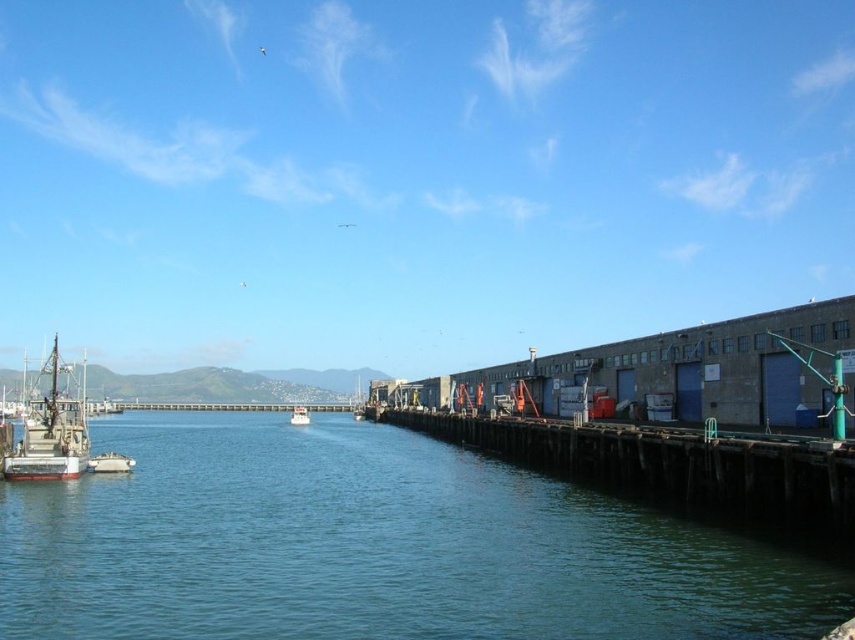
Question: Among these points, which one is nearest to the camera?

Choices:
 (A) (292, 412)
 (B) (46, 472)
 (C) (467, 435)

Answer: (B)

Question: Can you confirm if wooden dock at lower right is positioned to the left of white matte boat at left?

Choices:
 (A) yes
 (B) no

Answer: (B)

Question: Is greenish-blue water at left closer to the viewer compared to white matte boat at left?

Choices:
 (A) no
 (B) yes

Answer: (B)

Question: Among these points, which one is nearest to the camera?

Choices:
 (A) (30, 451)
 (B) (475, 456)
 (C) (116, 456)

Answer: (A)

Question: Which of these objects is positioned farthest from the white matte boat at left?

Choices:
 (A) white matte boat at center
 (B) wooden dock at lower right
 (C) metallic gray boat at lower left
 (D) greenish-blue water at left

Answer: (A)

Question: Is greenish-blue water at left smaller than metallic gray boat at lower left?

Choices:
 (A) no
 (B) yes

Answer: (A)